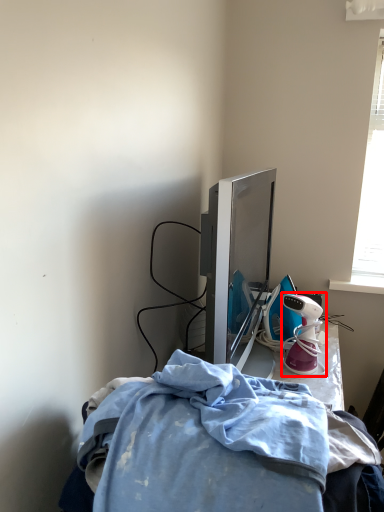
Question: From the image, what is the correct spatial relationship of toy (annotated by the red box) in relation to furniture?

Choices:
 (A) right
 (B) left

Answer: (A)